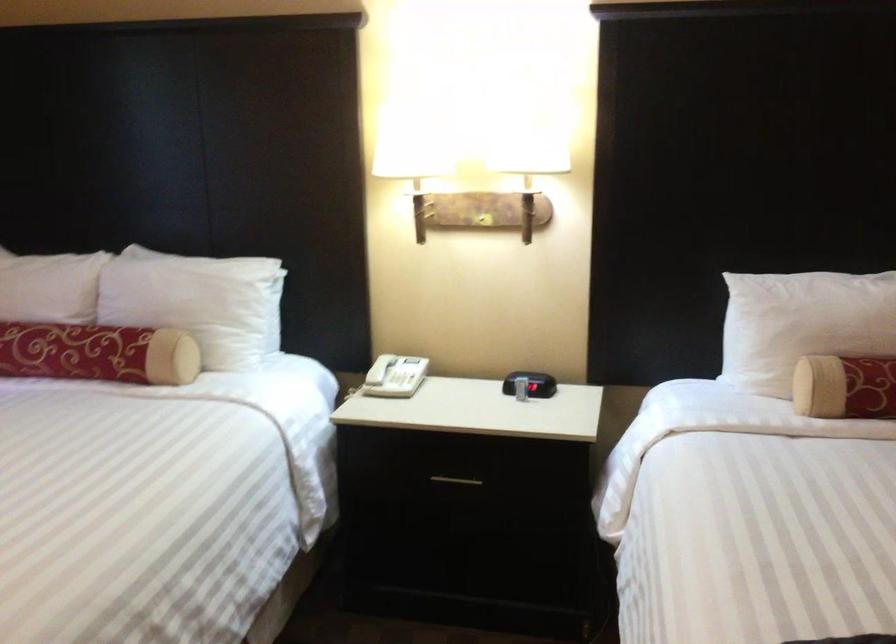
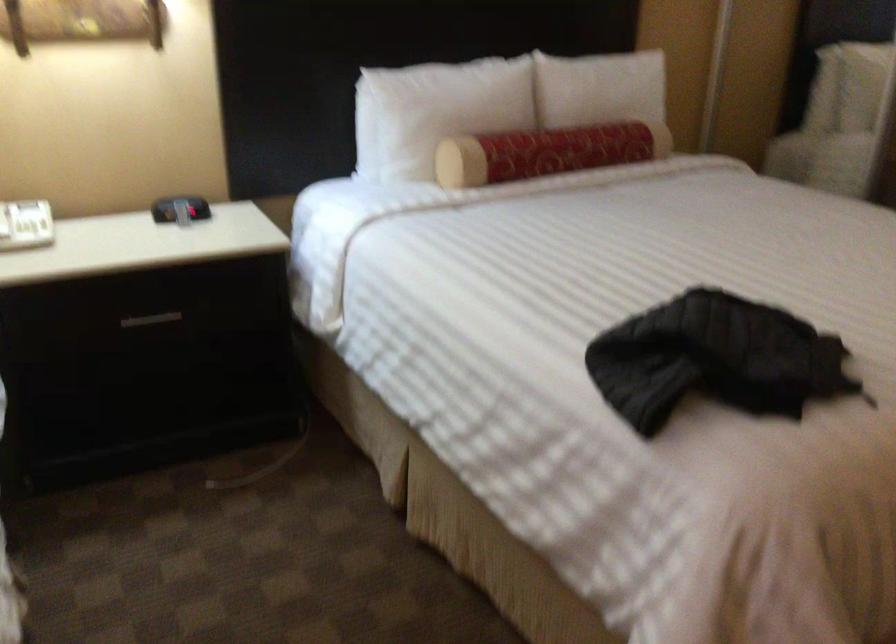
In the second image, find the point that corresponds to [514,381] in the first image.

(179, 209)